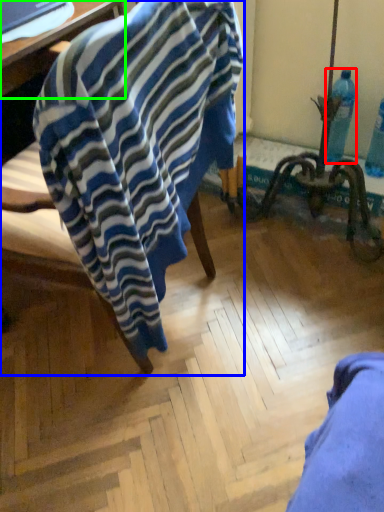
Question: Which object is positioned closest to bottle (highlighted by a red box)? Select from chair (highlighted by a blue box) and table (highlighted by a green box).

Choices:
 (A) chair
 (B) table

Answer: (A)